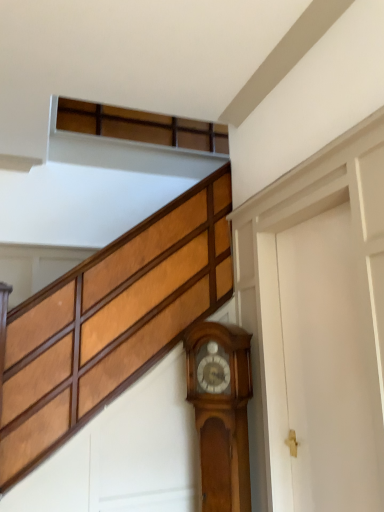
The image size is (384, 512). What are the coordinates of `white matte door at right` in the screenshot? It's located at (322, 362).

What do you see at coordinates (322, 362) in the screenshot? The width and height of the screenshot is (384, 512). I see `white matte door at right` at bounding box center [322, 362].

Image resolution: width=384 pixels, height=512 pixels. Describe the element at coordinates (221, 412) in the screenshot. I see `polished wood grandfather clock at lower right` at that location.

The width and height of the screenshot is (384, 512). I want to click on polished wood grandfather clock at lower right, so click(x=221, y=412).

You are a GUI agent. You are given a task and a screenshot of the screen. Output one action in this format:
    pyautogui.click(x=<x>, y=<y>)
    Task: Click on the white matte door at right
    The height and width of the screenshot is (512, 384).
    Given the screenshot: What is the action you would take?
    pyautogui.click(x=322, y=362)

In the scene shown: Is white matte door at right to the left of polished wood grandfather clock at lower right from the viewer's perspective?

Incorrect, white matte door at right is not on the left side of polished wood grandfather clock at lower right.

Is white matte door at right closer to the viewer compared to polished wood grandfather clock at lower right?

Yes, white matte door at right is closer to the viewer.

Does point (379, 404) appear closer or farther from the camera than point (210, 471)?

Point (379, 404).

From the image's perspective, is white matte door at right above polished wood grandfather clock at lower right?

Indeed, from the image's perspective, white matte door at right is shown above polished wood grandfather clock at lower right.

From a real-world perspective, is white matte door at right physically located above or below polished wood grandfather clock at lower right?

In terms of real-world spatial position, white matte door at right is above polished wood grandfather clock at lower right.

Based on the photo, which object is thinner, white matte door at right or polished wood grandfather clock at lower right?

white matte door at right.

Is white matte door at right shorter than polished wood grandfather clock at lower right?

In fact, white matte door at right may be taller than polished wood grandfather clock at lower right.

Between white matte door at right and polished wood grandfather clock at lower right, which one has larger size?

Bigger between the two is white matte door at right.

Is white matte door at right situated inside polished wood grandfather clock at lower right or outside?

white matte door at right is not inside polished wood grandfather clock at lower right, it's outside.

Is white matte door at right touching polished wood grandfather clock at lower right?

They are not placed beside each other.

Could you tell me if white matte door at right is facing polished wood grandfather clock at lower right?

No.

How many degrees apart are the facing directions of white matte door at right and polished wood grandfather clock at lower right?

They differ by 44.8 degrees in their facing directions.

How far apart are white matte door at right and polished wood grandfather clock at lower right?

white matte door at right and polished wood grandfather clock at lower right are 12.92 inches apart.

At what (x,y) coordinates should I click in order to perform the action: click on wall clock below the white matte door at right (from the image's perspective). Please return your answer as a coordinate pair (x, y). The image size is (384, 512). Looking at the image, I should click on (221, 412).

Visually, is polished wood grandfather clock at lower right positioned to the left or to the right of white matte door at right?

From the image, it's evident that polished wood grandfather clock at lower right is to the left of white matte door at right.

Is polished wood grandfather clock at lower right closer to camera compared to white matte door at right?

No, the depth of polished wood grandfather clock at lower right is greater than that of white matte door at right.

Considering the positions of point (219, 406) and point (298, 348), is point (219, 406) closer or farther from the camera than point (298, 348)?

Point (219, 406).

From the image's perspective, is polished wood grandfather clock at lower right below white matte door at right?

Yes, from the image's perspective, polished wood grandfather clock at lower right is below white matte door at right.

In the scene shown: From a real-world perspective, is polished wood grandfather clock at lower right over white matte door at right?

No, from a real-world perspective, polished wood grandfather clock at lower right is not over white matte door at right

Can you confirm if polished wood grandfather clock at lower right is thinner than white matte door at right?

No.

In terms of height, does polished wood grandfather clock at lower right look taller or shorter compared to white matte door at right?

Clearly, polished wood grandfather clock at lower right is shorter compared to white matte door at right.

Based on the photo, which of these two, polished wood grandfather clock at lower right or white matte door at right, is bigger?

Bigger between the two is white matte door at right.

Can we say polished wood grandfather clock at lower right lies outside white matte door at right?

Yes, polished wood grandfather clock at lower right is located beyond the bounds of white matte door at right.

Is polished wood grandfather clock at lower right positioned far away from white matte door at right?

No, polished wood grandfather clock at lower right is not far away from white matte door at right.

Is polished wood grandfather clock at lower right aimed at white matte door at right?

No.

Locate an element on the screen. Image resolution: width=384 pixels, height=512 pixels. wall clock below the white matte door at right (from the image's perspective) is located at coordinates (221, 412).

This screenshot has height=512, width=384. What are the coordinates of `garage door located on the right of polished wood grandfather clock at lower right` in the screenshot? It's located at (322, 362).

The height and width of the screenshot is (512, 384). I want to click on garage door that appears in front of the polished wood grandfather clock at lower right, so click(322, 362).